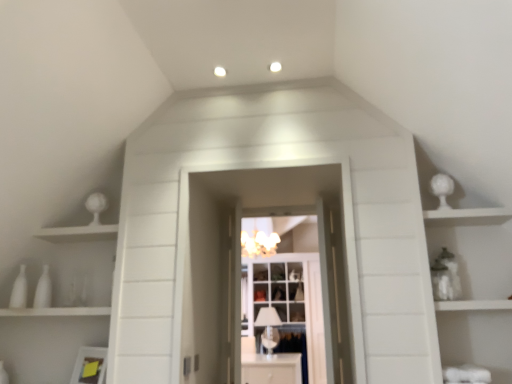
Question: Should I look upward or downward to see white glass cupboard at center?

Choices:
 (A) down
 (B) up

Answer: (A)

Question: Is white glossy sphere at upper right in contact with white glossy vases at left?

Choices:
 (A) yes
 (B) no

Answer: (B)

Question: Is white glossy sphere at upper right smaller than white glossy vases at left?

Choices:
 (A) yes
 (B) no

Answer: (A)

Question: From the image's perspective, is white glossy sphere at upper right on top of white glossy vases at left?

Choices:
 (A) yes
 (B) no

Answer: (A)

Question: Is white glossy sphere at upper right facing away from white glossy vases at left?

Choices:
 (A) yes
 (B) no

Answer: (B)

Question: Is white glossy sphere at upper right facing towards white glossy vases at left?

Choices:
 (A) yes
 (B) no

Answer: (B)

Question: Does white glossy sphere at upper right come in front of white glossy vases at left?

Choices:
 (A) no
 (B) yes

Answer: (B)

Question: Is the depth of clear glass cabinet at center less than that of white glossy vases at left?

Choices:
 (A) yes
 (B) no

Answer: (B)

Question: Is clear glass cabinet at center positioned behind white glossy vases at left?

Choices:
 (A) yes
 (B) no

Answer: (A)

Question: Considering the relative sizes of clear glass cabinet at center and white glossy vases at left in the image provided, is clear glass cabinet at center smaller than white glossy vases at left?

Choices:
 (A) yes
 (B) no

Answer: (B)

Question: From a real-world perspective, is clear glass cabinet at center over white glossy vases at left?

Choices:
 (A) yes
 (B) no

Answer: (A)

Question: From a real-world perspective, is clear glass cabinet at center physically below white glossy vases at left?

Choices:
 (A) yes
 (B) no

Answer: (B)

Question: Does clear glass cabinet at center have a greater height compared to white glossy vases at left?

Choices:
 (A) no
 (B) yes

Answer: (B)

Question: Considering the relative sizes of white glossy vases at left and white glossy cabinet at center in the image provided, is white glossy vases at left wider than white glossy cabinet at center?

Choices:
 (A) yes
 (B) no

Answer: (B)